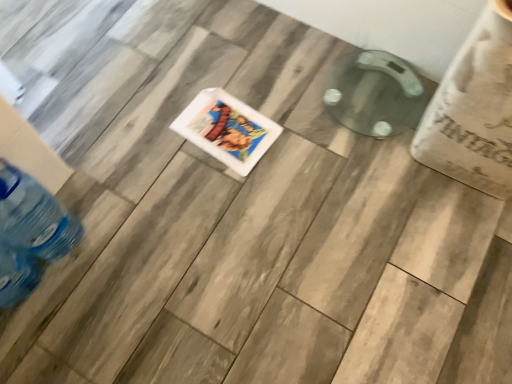
Question: Is translucent plastic bottle at lower left bigger than white glossy comic book at center?

Choices:
 (A) yes
 (B) no

Answer: (A)

Question: Could you tell me if translucent plastic bottle at lower left is facing white glossy comic book at center?

Choices:
 (A) no
 (B) yes

Answer: (A)

Question: Is translucent plastic bottle at lower left outside of white glossy comic book at center?

Choices:
 (A) no
 (B) yes

Answer: (B)

Question: Can you confirm if translucent plastic bottle at lower left is positioned to the right of white glossy comic book at center?

Choices:
 (A) yes
 (B) no

Answer: (B)

Question: From the image's perspective, is translucent plastic bottle at lower left under white glossy comic book at center?

Choices:
 (A) yes
 (B) no

Answer: (A)

Question: Is translucent plastic bottle at lower left surrounding white glossy comic book at center?

Choices:
 (A) no
 (B) yes

Answer: (A)

Question: Is white glossy comic book at center oriented towards translucent plastic bottle at lower left?

Choices:
 (A) yes
 (B) no

Answer: (B)

Question: Does white glossy comic book at center have a lesser width compared to translucent plastic bottle at lower left?

Choices:
 (A) no
 (B) yes

Answer: (A)

Question: Is translucent plastic bottle at lower left a part of white glossy comic book at center?

Choices:
 (A) no
 (B) yes

Answer: (A)

Question: Can you confirm if white glossy comic book at center is shorter than translucent plastic bottle at lower left?

Choices:
 (A) yes
 (B) no

Answer: (A)

Question: From the image's perspective, is white glossy comic book at center above translucent plastic bottle at lower left?

Choices:
 (A) no
 (B) yes

Answer: (B)

Question: Is there a large distance between white glossy comic book at center and translucent plastic bottle at lower left?

Choices:
 (A) yes
 (B) no

Answer: (B)

Question: From a real-world perspective, is white glossy comic book at center positioned above or below translucent plastic bottle at lower left?

Choices:
 (A) above
 (B) below

Answer: (B)